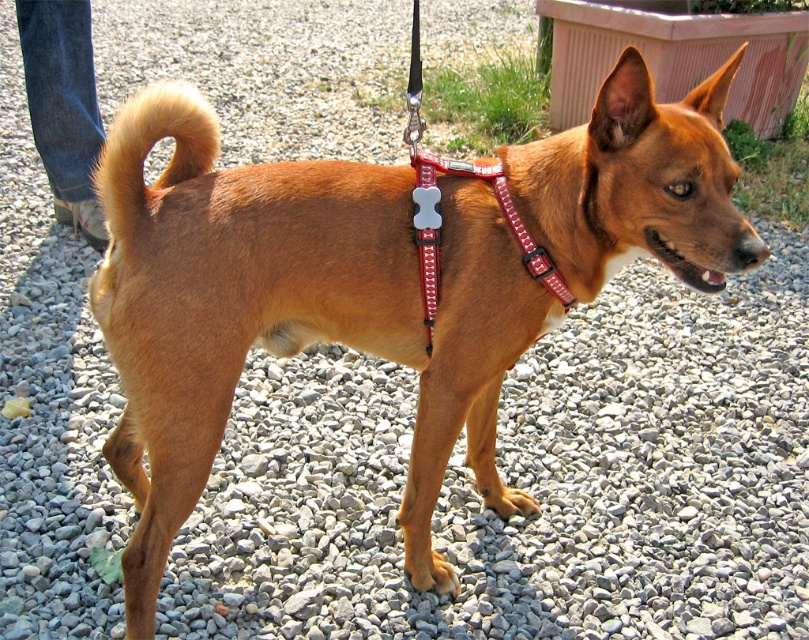
Question: Does golden fur tail at upper left have a smaller size compared to red fabric bone-shaped collar at center?

Choices:
 (A) no
 (B) yes

Answer: (B)

Question: Which point is farther from the camera taking this photo?

Choices:
 (A) (498, 198)
 (B) (215, 145)

Answer: (A)

Question: Which of the following is the farthest from the observer?

Choices:
 (A) red fabric bone-shaped collar at center
 (B) golden fur tail at upper left

Answer: (A)

Question: Does golden fur tail at upper left appear under red fabric bone-shaped collar at center?

Choices:
 (A) yes
 (B) no

Answer: (B)

Question: In this image, where is golden fur tail at upper left located relative to red fabric bone-shaped collar at center?

Choices:
 (A) right
 (B) left

Answer: (B)

Question: Which object is closer to the camera taking this photo?

Choices:
 (A) golden fur tail at upper left
 (B) red fabric bone-shaped collar at center

Answer: (A)